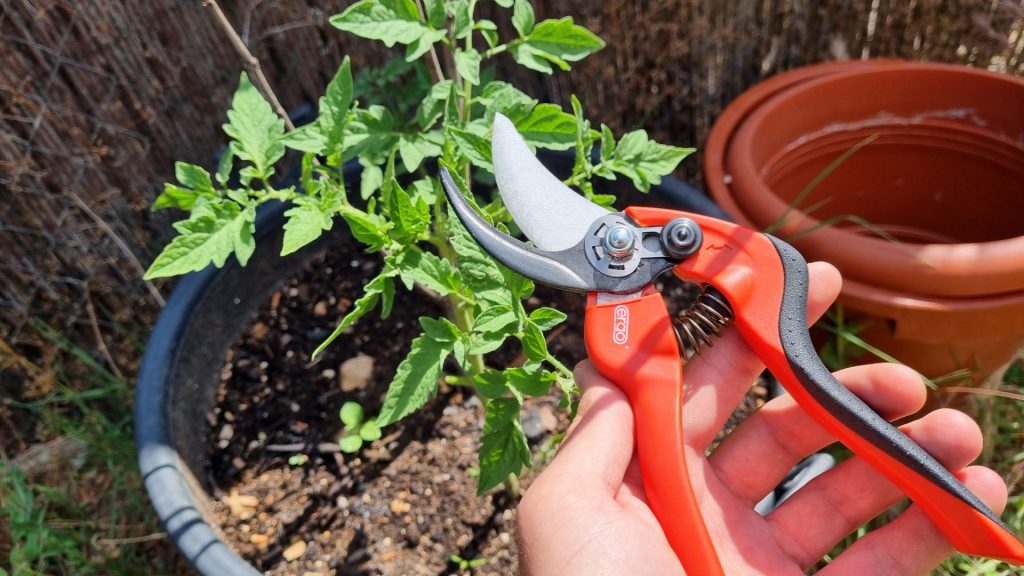
Where is `red pot`? This screenshot has width=1024, height=576. red pot is located at coordinates (951, 280).